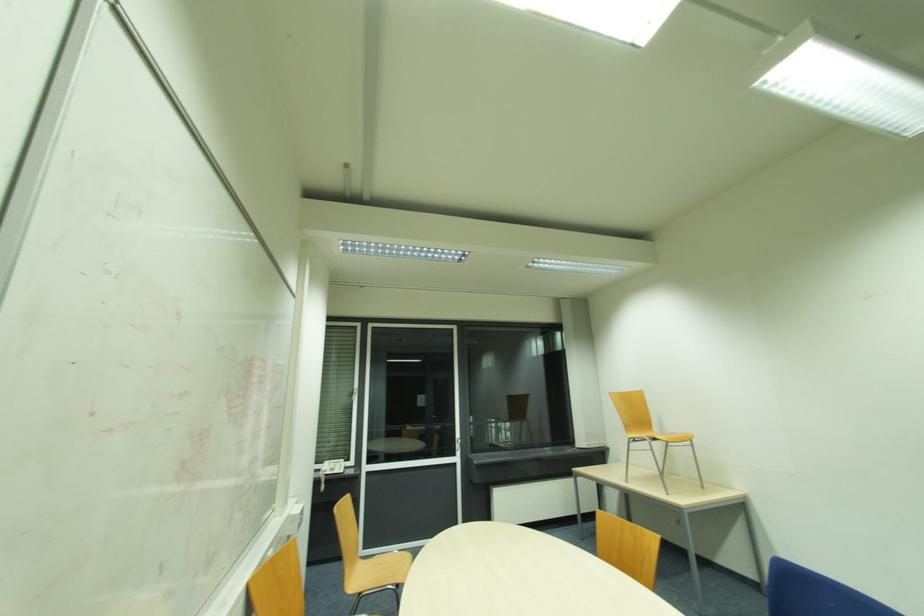
This screenshot has width=924, height=616. What do you see at coordinates (353, 395) in the screenshot?
I see `a silver window handle` at bounding box center [353, 395].